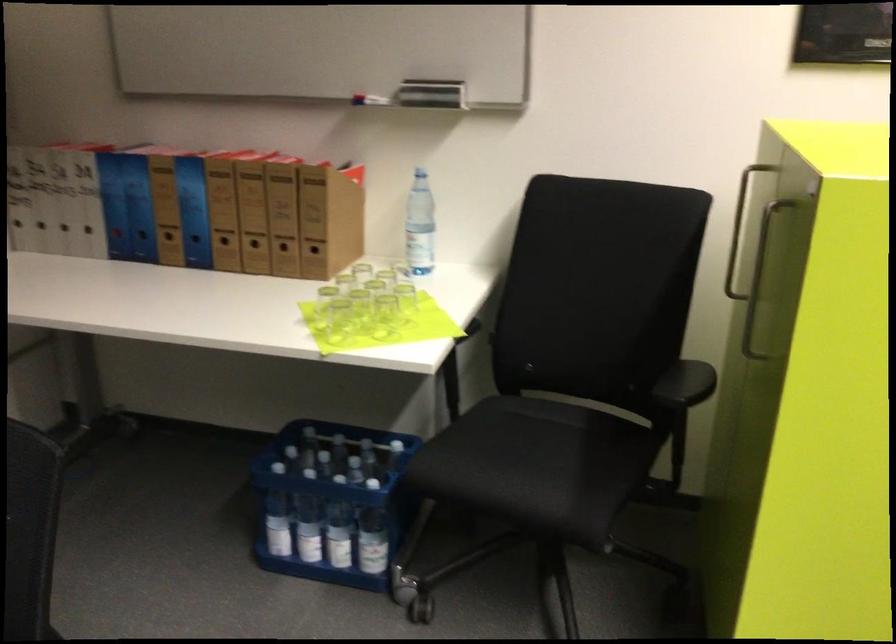
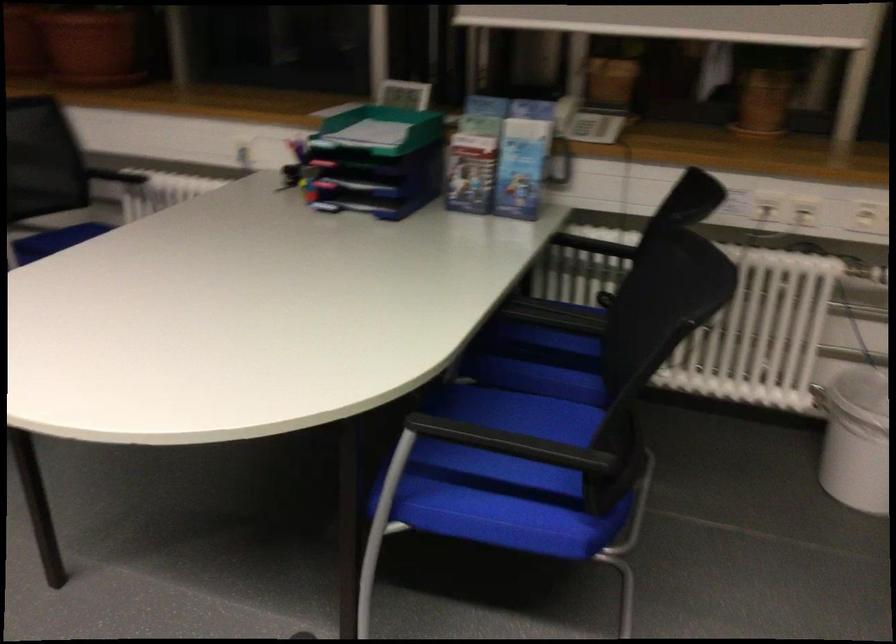
First-person continuous shooting, in which direction is the camera rotating?

The camera's rotation is toward left-down.